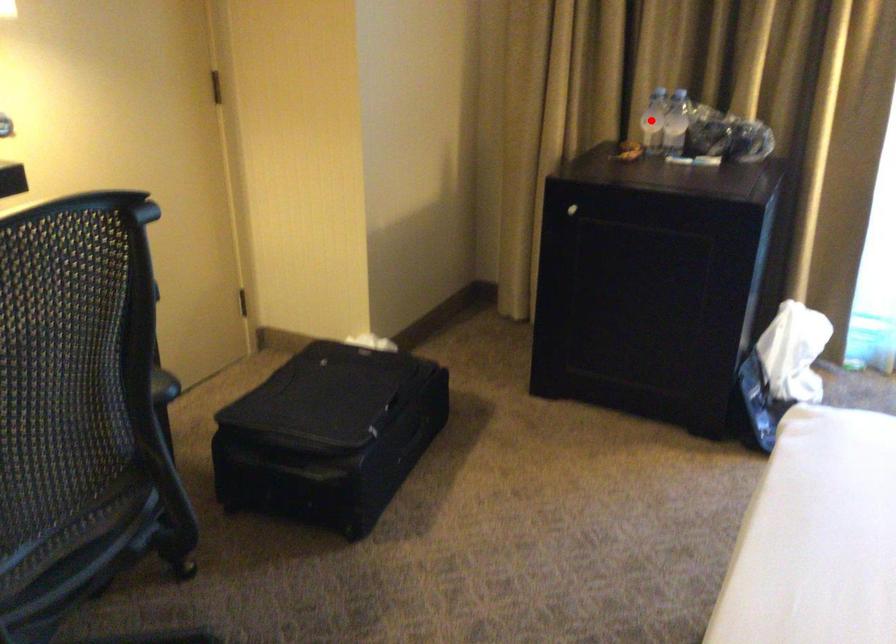
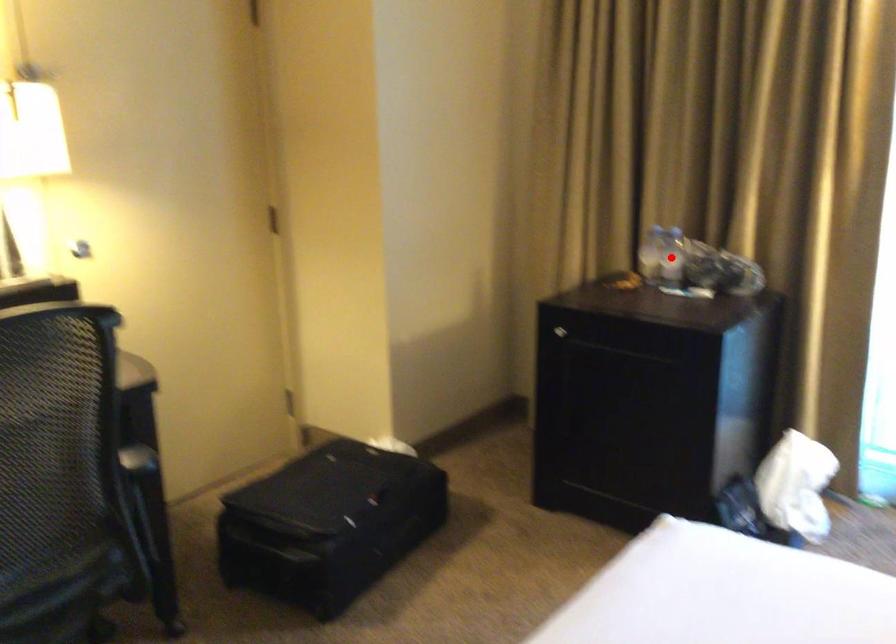
I am providing you with two images of the same scene from different viewpoints. A red point is marked on the first image and another point is marked on the second image. Is the marked point in image1 the same physical position as the marked point in image2?

No